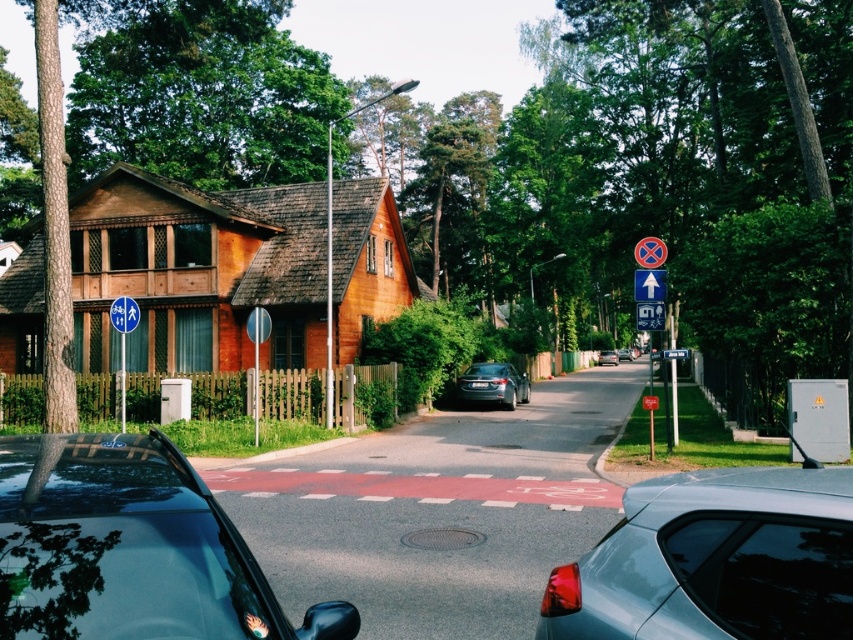
You are standing on the residential street and want to walk from point (136, 316) to point (651, 316). Which direction should you face to move towards the point that is further away from you?

You should face towards the point (651, 316) because it is further away from you than point (136, 316).